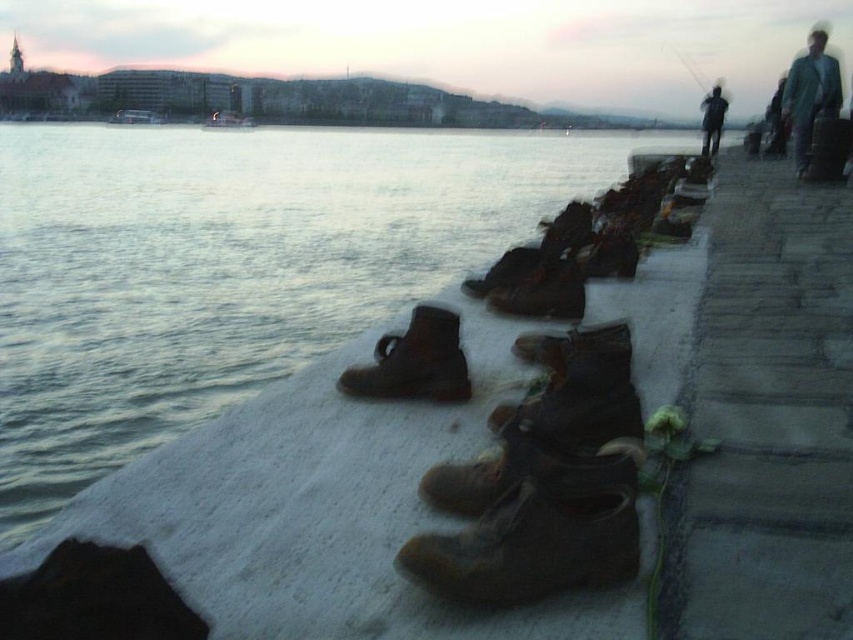
Question: Which point appears farthest from the camera in this image?

Choices:
 (A) (19, 253)
 (B) (462, 385)
 (C) (718, 132)
 (D) (834, 99)

Answer: (C)

Question: Which is nearer to the dark blue jeans at upper right?

Choices:
 (A) metallic fishing pole at upper right
 (B) leather shoes at center

Answer: (A)

Question: Is greenish-gray fabric jacket at upper right above dark blue jeans at upper right?

Choices:
 (A) yes
 (B) no

Answer: (B)

Question: From the image, what is the correct spatial relationship of leather boot at center in relation to dark blue jeans at upper right?

Choices:
 (A) below
 (B) above

Answer: (A)

Question: Is leather shoes at center wider than greenish-gray fabric jacket at upper right?

Choices:
 (A) yes
 (B) no

Answer: (B)

Question: Which point is closer to the camera?

Choices:
 (A) (787, 99)
 (B) (654, 134)
 (C) (676, 54)

Answer: (A)